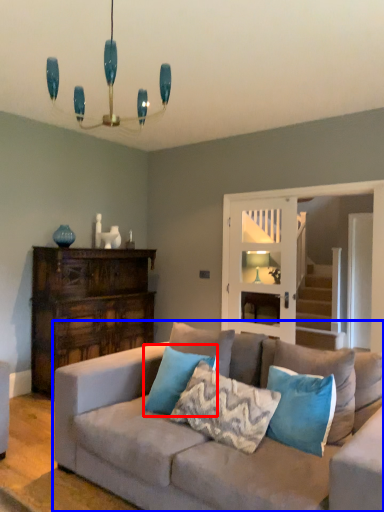
Question: Which of the following is the farthest to the observer, pillow (highlighted by a red box) or studio couch (highlighted by a blue box)?

Choices:
 (A) pillow
 (B) studio couch

Answer: (A)